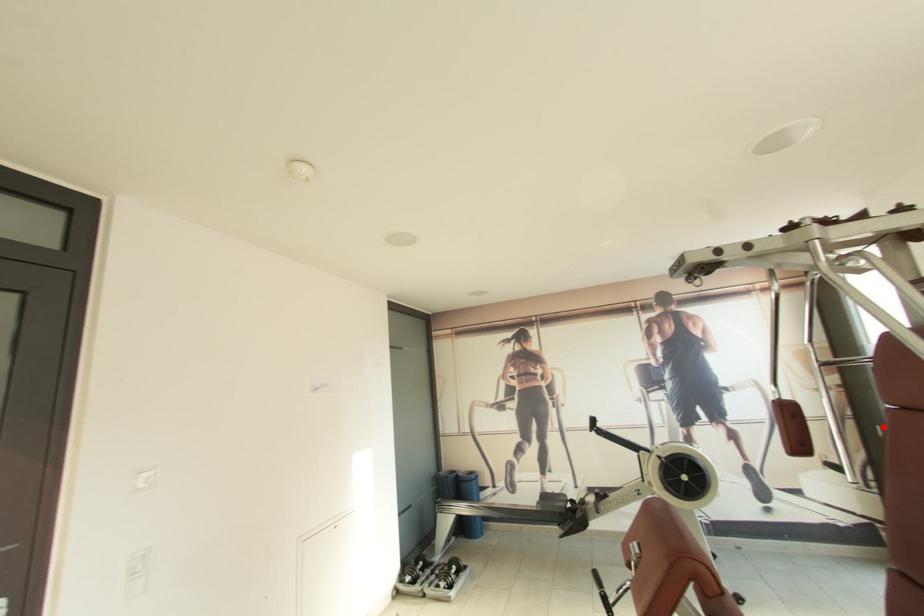
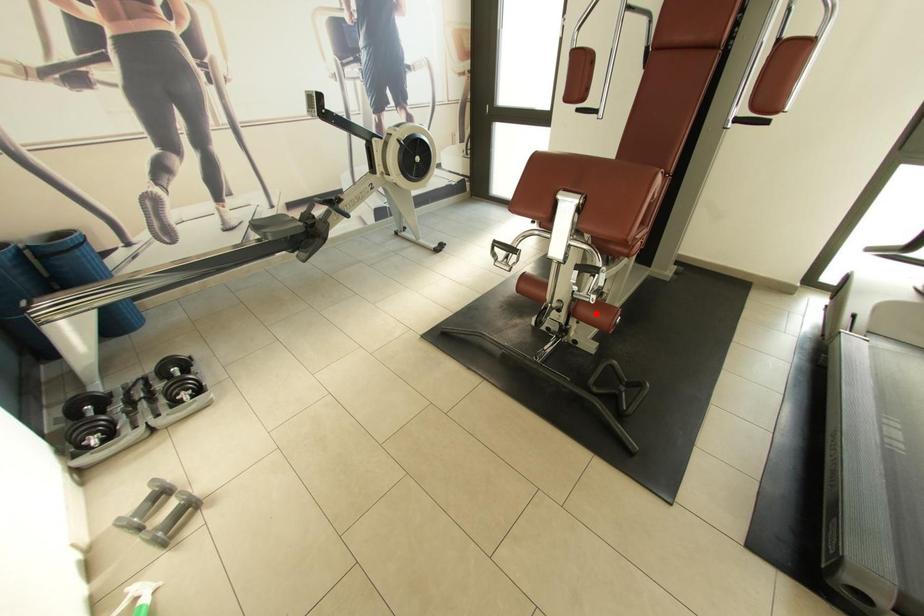
I am providing you with two images of the same scene from different viewpoints. A red point is marked on the first image and another point is marked on the second image. Is the marked point in image1 the same physical position as the marked point in image2?

No